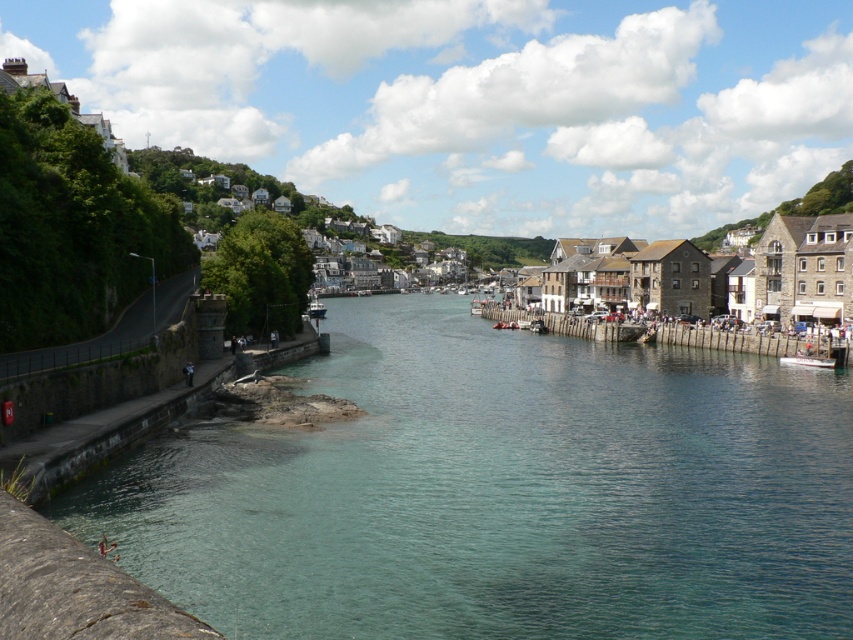
Is white glossy boat at center positioned at the back of metallic silver boat at center?

That is False.

Does white glossy boat at center appear on the right side of metallic silver boat at center?

Indeed, white glossy boat at center is positioned on the right side of metallic silver boat at center.

Find the location of a particular element. The height and width of the screenshot is (640, 853). white glossy boat at center is located at coordinates (808, 360).

Where is `white glossy boat at center`? This screenshot has width=853, height=640. white glossy boat at center is located at coordinates (808, 360).

Describe the element at coordinates (502, 492) in the screenshot. I see `clear water at lower left` at that location.

What are the coordinates of `clear water at lower left` in the screenshot? It's located at (502, 492).

Can you confirm if clear water at lower left is bigger than white glossy boat at center?

Yes, clear water at lower left is bigger than white glossy boat at center.

Which is behind, point (645, 541) or point (782, 356)?

The point (782, 356) is more distant.

Who is more distant from viewer, [218,500] or [782,358]?

The point [782,358] is more distant.

I want to click on clear water at lower left, so click(502, 492).